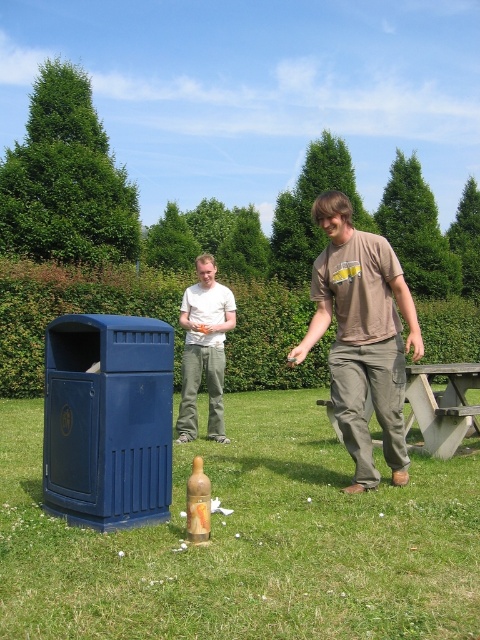
How far apart are green grass at lower center and translucent glass bottle at center?

The distance of green grass at lower center from translucent glass bottle at center is 7.88 feet.

Is green grass at lower center further to the viewer compared to translucent glass bottle at center?

That is True.

You are a GUI agent. You are given a task and a screenshot of the screen. Output one action in this format:
    pyautogui.click(x=<x>, y=<y>)
    Task: Click on the green grass at lower center
    
    Given the screenshot: What is the action you would take?
    pyautogui.click(x=249, y=541)

Can you confirm if green grass at lower center is smaller than white cotton t-shirt at center?

Indeed, green grass at lower center has a smaller size compared to white cotton t-shirt at center.

Between point (415, 611) and point (195, 330), which one is positioned in front?

Point (415, 611) is in front.

Does point (387, 532) lie in front of point (216, 380)?

That is True.

Identify the location of green grass at lower center. (249, 541).

Is brown cotton t-shirt at center to the right of white cotton t-shirt at center from the viewer's perspective?

Yes, brown cotton t-shirt at center is to the right of white cotton t-shirt at center.

Who is more forward, (383, 285) or (216, 355)?

Point (383, 285) is more forward.

Where is `brown cotton t-shirt at center`? brown cotton t-shirt at center is located at coordinates (361, 337).